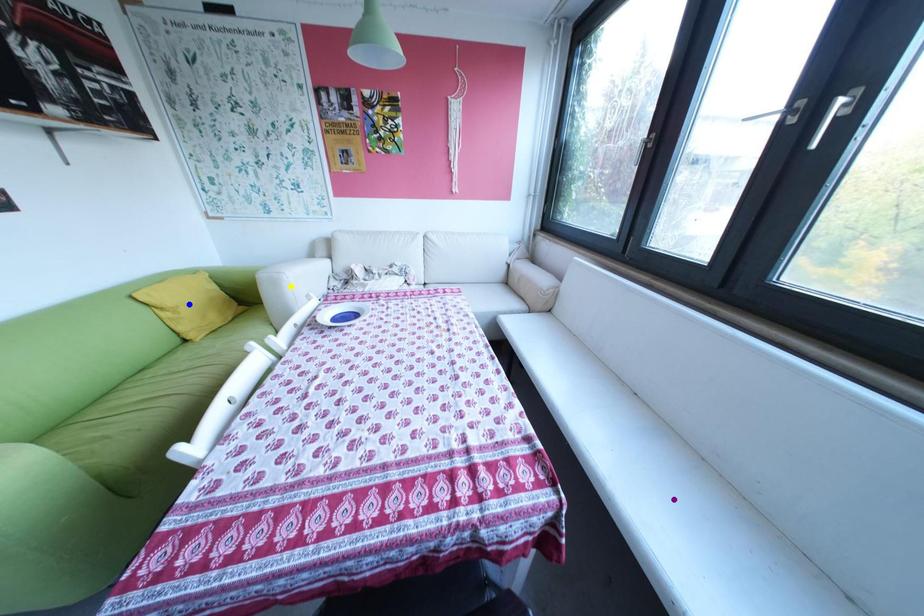
Order these from nearest to farthest:
- yellow point
- purple point
- blue point

purple point < yellow point < blue point